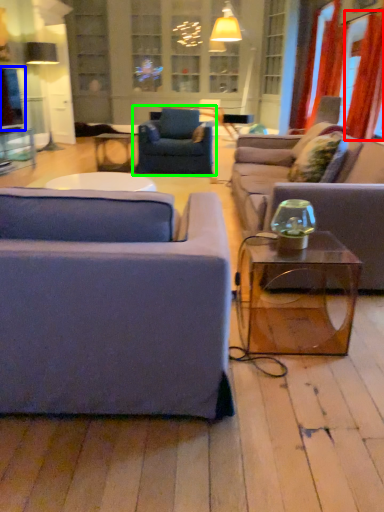
Question: Based on their relative distances, which object is nearer to curtain (highlighted by a red box)? Choose from window screen (highlighted by a blue box) and chair (highlighted by a green box).

Choices:
 (A) window screen
 (B) chair

Answer: (B)